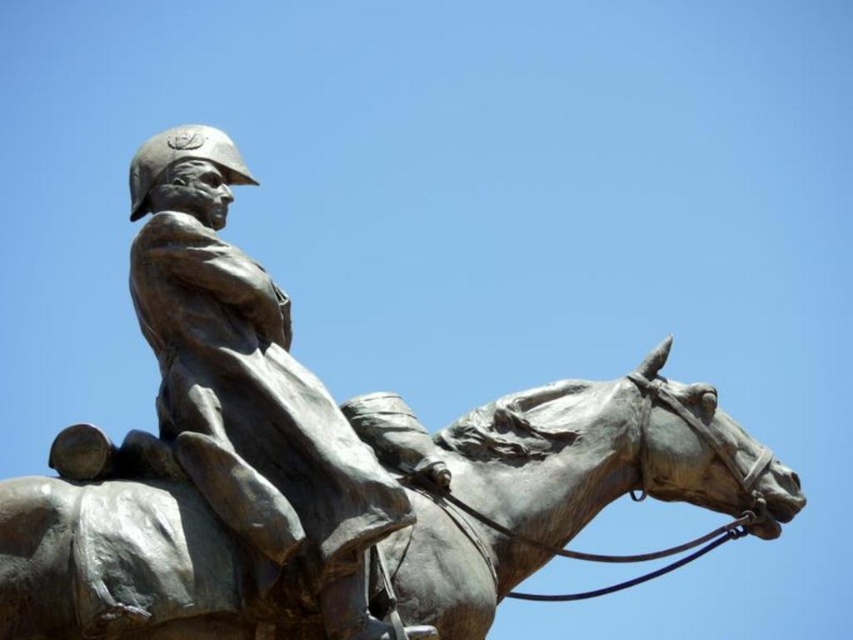
You are standing in front of the statue and need to place a small plaque exactly at the base of the bronze horse at center. According to the coordinates provided, where should you place the plaque?

The bronze horse at center is located at point (572,484), so the plaque should be placed at those coordinates at the base of the bronze horse at center.

You are a sculptor who needs to transport the bronze statue at center and the bronze horse at center. You have a truck with a 1.5 meter wide loading area. Can both items fit side by side horizontally?

The bronze horse at center might be wider than bronze statue at center, so it is uncertain if both can fit side by side in the 1.5 meter wide loading area without overlapping. Check their exact widths first.